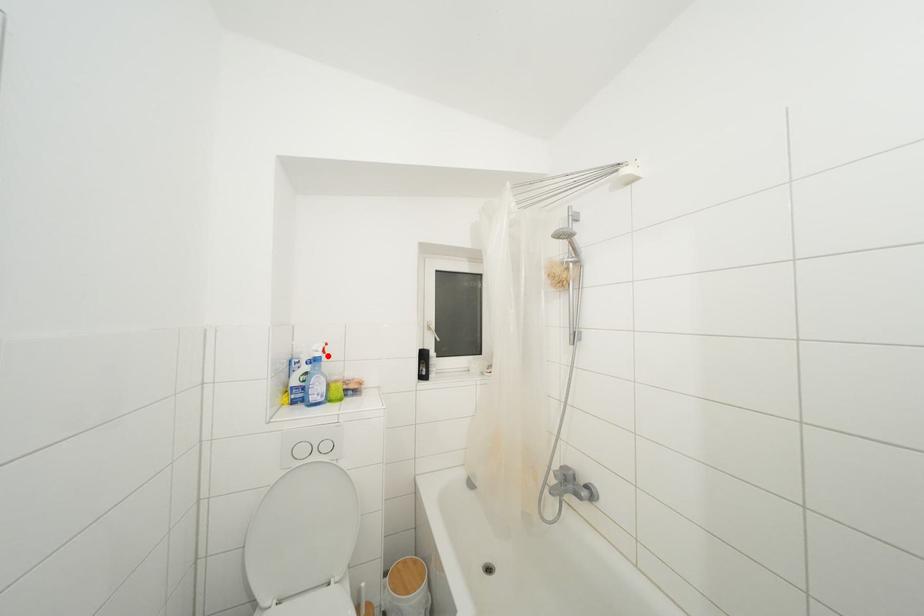
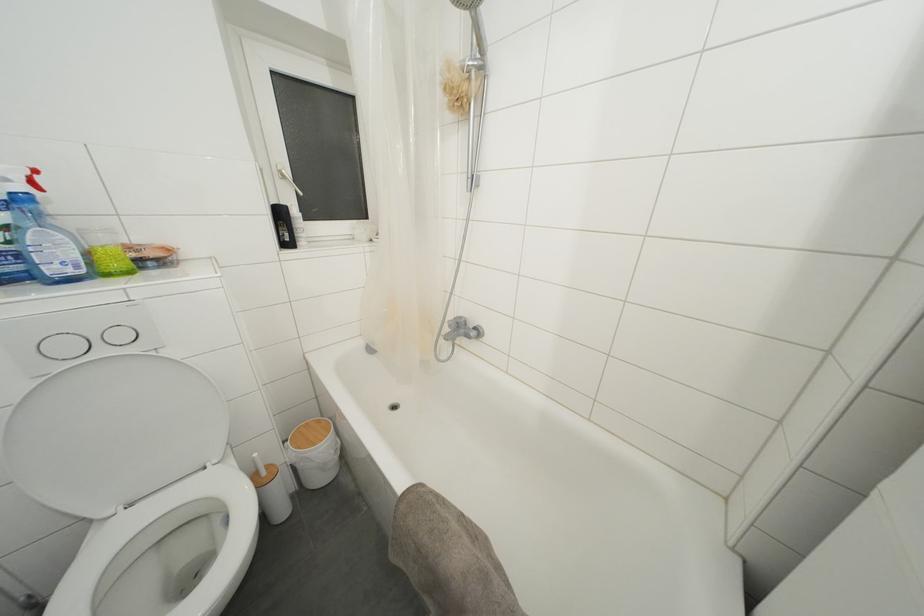
Question: A red point is marked in image1. In image2, is the corresponding 3D point closer to the camera or farther? Reply with the corresponding letter.

Choices:
 (A) The corresponding 3D point is closer.
 (B) The corresponding 3D point is farther.

Answer: (B)